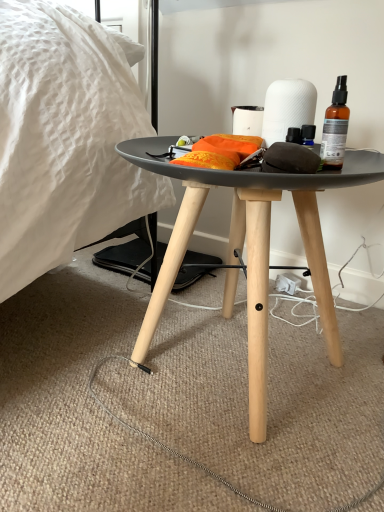
The image size is (384, 512). I want to click on black matte side table at center, so click(x=250, y=247).

The height and width of the screenshot is (512, 384). I want to click on white matte paper towel at center, so click(287, 108).

In order to click on orange fabric at center in this screenshot , I will do `click(219, 152)`.

Where is `translucent amber glass spray bottle at upper right`? This screenshot has height=512, width=384. translucent amber glass spray bottle at upper right is located at coordinates (335, 127).

Based on the photo, considering the sizes of translucent amber glass spray bottle at upper right and white matte paper towel at center in the image, is translucent amber glass spray bottle at upper right bigger or smaller than white matte paper towel at center?

In the image, translucent amber glass spray bottle at upper right appears to be smaller than white matte paper towel at center.

In terms of width, does translucent amber glass spray bottle at upper right look wider or thinner when compared to white matte paper towel at center?

Considering their sizes, translucent amber glass spray bottle at upper right looks slimmer than white matte paper towel at center.

From the image's perspective, which object appears higher, translucent amber glass spray bottle at upper right or white matte paper towel at center?

white matte paper towel at center appears higher in the image.

Is translucent amber glass spray bottle at upper right looking in the opposite direction of white matte paper towel at center?

No, white matte paper towel at center is not at the back of translucent amber glass spray bottle at upper right.

Considering the sizes of objects white matte paper towel at center and translucent amber glass spray bottle at upper right in the image provided, who is shorter, white matte paper towel at center or translucent amber glass spray bottle at upper right?

white matte paper towel at center is shorter.

Is point (306, 102) positioned before point (331, 143)?

No, (306, 102) is behind (331, 143).

At what (x,y) coordinates should I click in order to perform the action: click on bottle on the right of white matte paper towel at center. Please return your answer as a coordinate pair (x, y). Looking at the image, I should click on (335, 127).

Is white matte paper towel at center closer to camera compared to translucent amber glass spray bottle at upper right?

No, white matte paper towel at center is behind translucent amber glass spray bottle at upper right.

Which object is positioned more to the left, orange fabric at center or white matte paper towel at center?

Positioned to the left is orange fabric at center.

Is orange fabric at center positioned before white matte paper towel at center?

Yes, orange fabric at center is closer to the camera.

Between orange fabric at center and white matte paper towel at center, which one has less height?

With less height is orange fabric at center.

Is black matte side table at center at the back of translucent amber glass spray bottle at upper right?

translucent amber glass spray bottle at upper right is not turned away from black matte side table at center.

Is translucent amber glass spray bottle at upper right to the left or to the right of black matte side table at center in the image?

translucent amber glass spray bottle at upper right is positioned on black matte side table at center's right side.

Would you consider translucent amber glass spray bottle at upper right to be distant from black matte side table at center?

translucent amber glass spray bottle at upper right is near black matte side table at center, not far away.

Based on the photo, measure the distance between translucent amber glass spray bottle at upper right and black matte side table at center.

A distance of 8.51 inches exists between translucent amber glass spray bottle at upper right and black matte side table at center.

Looking at this image, is white matte paper towel at center spatially inside black matte side table at center, or outside of it?

white matte paper towel at center exists outside the volume of black matte side table at center.

Between point (303, 103) and point (266, 372), which one is positioned behind?

The point (266, 372) is farther.

Is white matte paper towel at center far from black matte side table at center?

Actually, white matte paper towel at center and black matte side table at center are a little close together.

How far apart are white matte paper towel at center and black matte side table at center?

white matte paper towel at center and black matte side table at center are 9.21 inches apart from each other.

In the scene shown: Does white matte paper towel at center turn towards orange fabric at center?

Yes, white matte paper towel at center is turned towards orange fabric at center.

From a real-world perspective, is white matte paper towel at center located beneath orange fabric at center?

Incorrect, from a real-world perspective, white matte paper towel at center is higher than orange fabric at center.

From the image's perspective, who appears lower, white matte paper towel at center or orange fabric at center?

orange fabric at center.

Is white matte paper towel at center surrounding orange fabric at center?

No, orange fabric at center is located outside of white matte paper towel at center.

Is orange fabric at center aimed at translucent amber glass spray bottle at upper right?

No, orange fabric at center is not aimed at translucent amber glass spray bottle at upper right.

In order to click on material below the translucent amber glass spray bottle at upper right (from the image's perspective) in this screenshot , I will do `click(219, 152)`.

Choose the correct answer: Is orange fabric at center inside translucent amber glass spray bottle at upper right or outside it?

orange fabric at center exists outside the volume of translucent amber glass spray bottle at upper right.

Between orange fabric at center and translucent amber glass spray bottle at upper right, which one has less height?

orange fabric at center is shorter.

Locate an element on the screen. This screenshot has height=512, width=384. bottle lying on the right of white matte paper towel at center is located at coordinates (335, 127).

You are a GUI agent. You are given a task and a screenshot of the screen. Output one action in this format:
    pyautogui.click(x=<x>, y=<y>)
    Task: Click on the bottle below the white matte paper towel at center (from a real-world perspective)
    
    Given the screenshot: What is the action you would take?
    (335, 127)

Based on their spatial positions, is orange fabric at center or translucent amber glass spray bottle at upper right further from white matte paper towel at center?

orange fabric at center.

When comparing their distances from translucent amber glass spray bottle at upper right, does white matte paper towel at center or black matte side table at center seem closer?

Among the two, white matte paper towel at center is located nearer to translucent amber glass spray bottle at upper right.

In the scene shown: When comparing their distances from black matte side table at center, does translucent amber glass spray bottle at upper right or white matte paper towel at center seem closer?

translucent amber glass spray bottle at upper right.

In the scene shown: Considering their positions, is black matte side table at center positioned closer to translucent amber glass spray bottle at upper right than orange fabric at center?

orange fabric at center is closer to translucent amber glass spray bottle at upper right.

Which object lies nearer to the anchor point black matte side table at center, white matte paper towel at center or orange fabric at center?

Among the two, orange fabric at center is located nearer to black matte side table at center.

Looking at the image, which one is located further to white matte paper towel at center, translucent amber glass spray bottle at upper right or orange fabric at center?

orange fabric at center is further to white matte paper towel at center.

Which object lies nearer to the anchor point translucent amber glass spray bottle at upper right, orange fabric at center or white matte paper towel at center?

Among the two, white matte paper towel at center is located nearer to translucent amber glass spray bottle at upper right.

From the image, which object appears to be nearer to white matte paper towel at center, translucent amber glass spray bottle at upper right or black matte side table at center?

The object closer to white matte paper towel at center is translucent amber glass spray bottle at upper right.

What are the coordinates of `material that lies between translucent amber glass spray bottle at upper right and black matte side table at center from top to bottom` in the screenshot? It's located at (219, 152).

Where is `material positioned between black matte side table at center and white matte paper towel at center from near to far`? The image size is (384, 512). material positioned between black matte side table at center and white matte paper towel at center from near to far is located at coordinates (219, 152).

Locate an element on the screen. This screenshot has width=384, height=512. paper towel between orange fabric at center and translucent amber glass spray bottle at upper right in the horizontal direction is located at coordinates (287, 108).

The image size is (384, 512). I want to click on bottle positioned between black matte side table at center and white matte paper towel at center from near to far, so click(x=335, y=127).